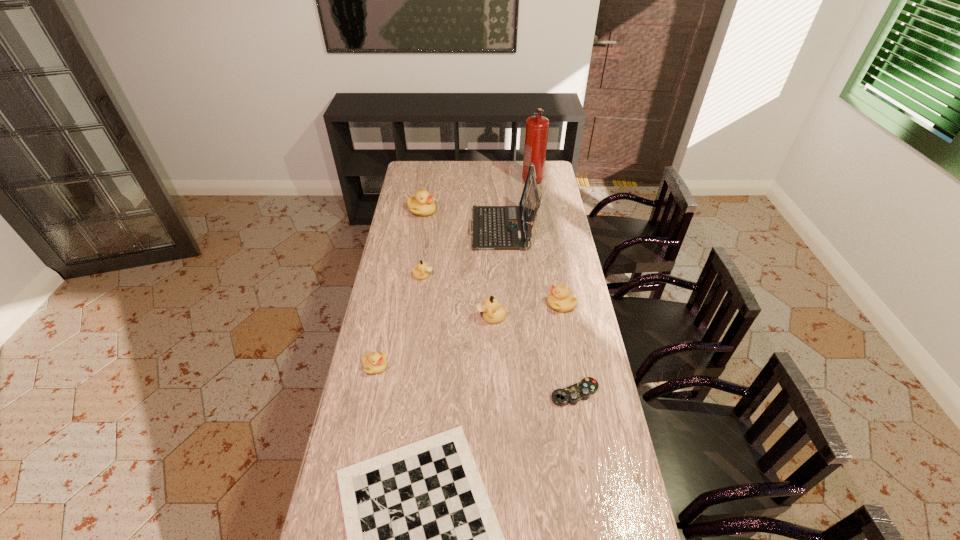
Find the location of a particular element. unoccupied area between the right tan duckling and the biggest yellow duckling is located at coordinates (457, 264).

Locate an element on the screen. This screenshot has height=540, width=960. vacant space in between the red fire extinguisher and the smallest yellow duckling is located at coordinates (454, 273).

This screenshot has height=540, width=960. I want to click on vacant point located between the sixth nearest object and the control, so tap(499, 335).

Where is `empty space between the farthest yellow duckling and the farthest object`? empty space between the farthest yellow duckling and the farthest object is located at coordinates (477, 195).

Find the location of a particular element. Image resolution: width=960 pixels, height=540 pixels. empty space between the control and the fourth farthest object is located at coordinates (499, 335).

This screenshot has height=540, width=960. I want to click on object that is the fifth nearest to the nearest yellow duckling, so click(494, 227).

Find the location of a particular element. The height and width of the screenshot is (540, 960). object that ranks as the third closest to the laptop computer is located at coordinates pos(421,272).

You are a GUI agent. You are given a task and a screenshot of the screen. Output one action in this format:
    pyautogui.click(x=<x>, y=<y>)
    Task: Click on the duckling that is the third closest one to the rightmost duckling
    
    Given the screenshot: What is the action you would take?
    pyautogui.click(x=373, y=363)

You are a GUI agent. You are given a task and a screenshot of the screen. Output one action in this format:
    pyautogui.click(x=<x>, y=<y>)
    Task: Click on the duckling that stands as the third closest to the tallest object
    This screenshot has height=540, width=960.
    Given the screenshot: What is the action you would take?
    pyautogui.click(x=560, y=299)

The height and width of the screenshot is (540, 960). In order to click on yellow duckling that is the second nearest to the shortest object in this screenshot , I will do `click(560, 299)`.